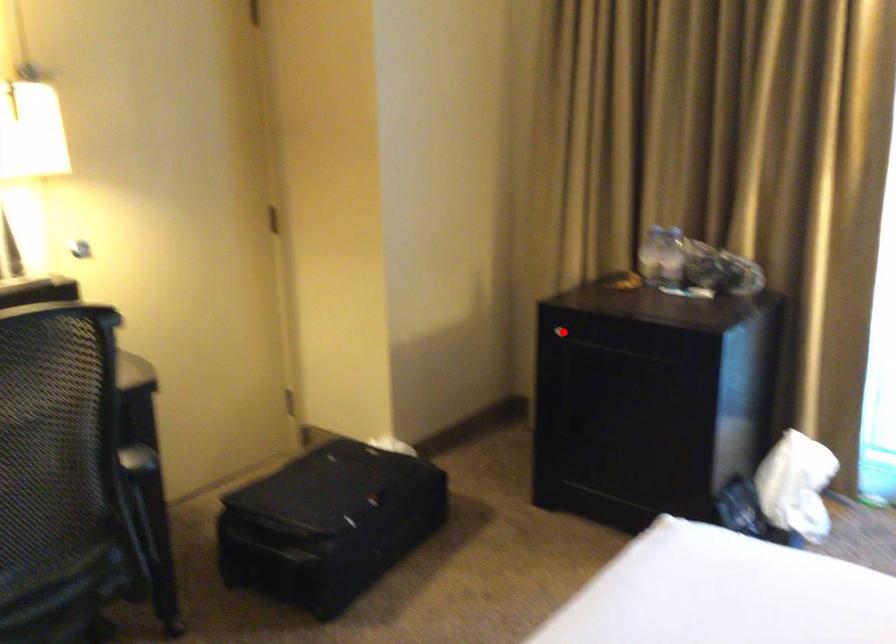
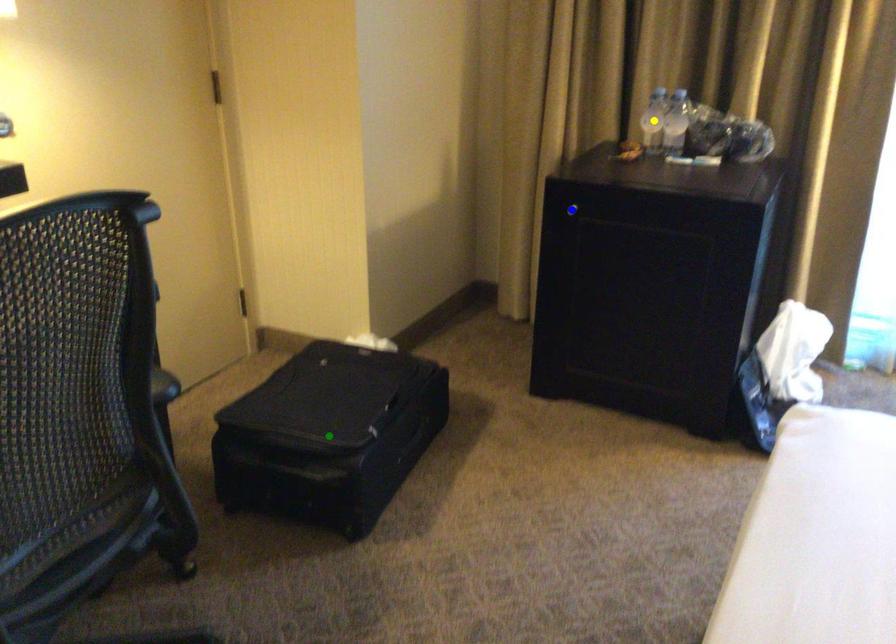
Question: I am providing you with two images of the same scene from different viewpoints. A red point is marked on the first image. You are given multiple points on the second image. Which point in image 2 is actually the same real-world point as the red point in image 1?

Choices:
 (A) yellow point
 (B) blue point
 (C) green point

Answer: (B)